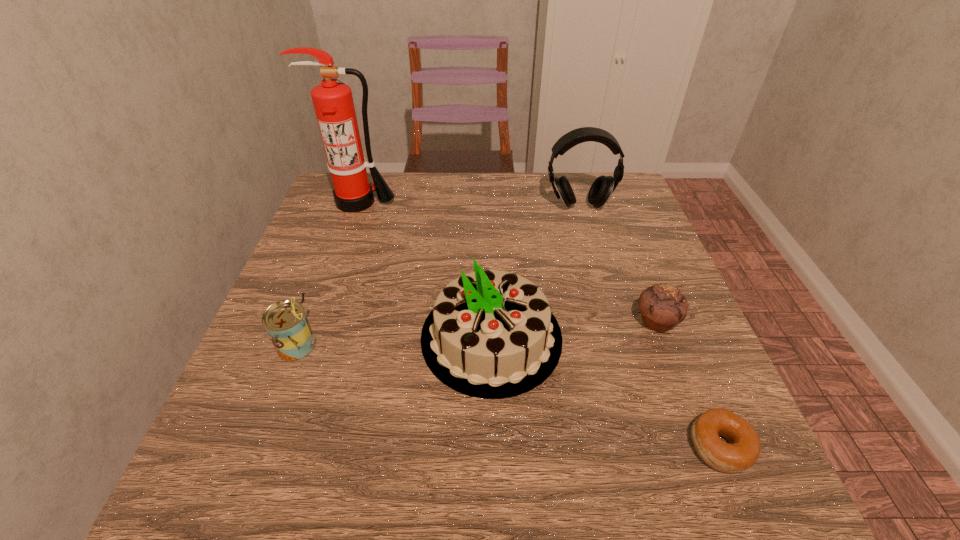
Locate an element on the screen. The image size is (960, 540). the tallest object is located at coordinates (333, 102).

This screenshot has width=960, height=540. I want to click on earphone, so click(602, 188).

What are the coordinates of `birthday cake` in the screenshot? It's located at tap(491, 334).

The image size is (960, 540). I want to click on the fourth shortest object, so click(x=491, y=334).

Where is `can`? can is located at coordinates (286, 323).

You are a GUI agent. You are given a task and a screenshot of the screen. Output one action in this format:
    pyautogui.click(x=<x>, y=<y>)
    Task: Click on the fifth tallest object
    The width and height of the screenshot is (960, 540).
    Given the screenshot: What is the action you would take?
    pyautogui.click(x=662, y=306)

At what (x,y) coordinates should I click in order to perform the action: click on the shortest object. Please return your answer as a coordinate pair (x, y). This screenshot has width=960, height=540. Looking at the image, I should click on tap(742, 451).

Locate an element on the screen. Image resolution: width=960 pixels, height=540 pixels. the nearest object is located at coordinates (742, 451).

This screenshot has width=960, height=540. I want to click on free space located at the nozzle of the fire extinguisher, so click(x=332, y=274).

Find the location of a particular element. The width and height of the screenshot is (960, 540). free space located on the ear cups of the earphone is located at coordinates (592, 252).